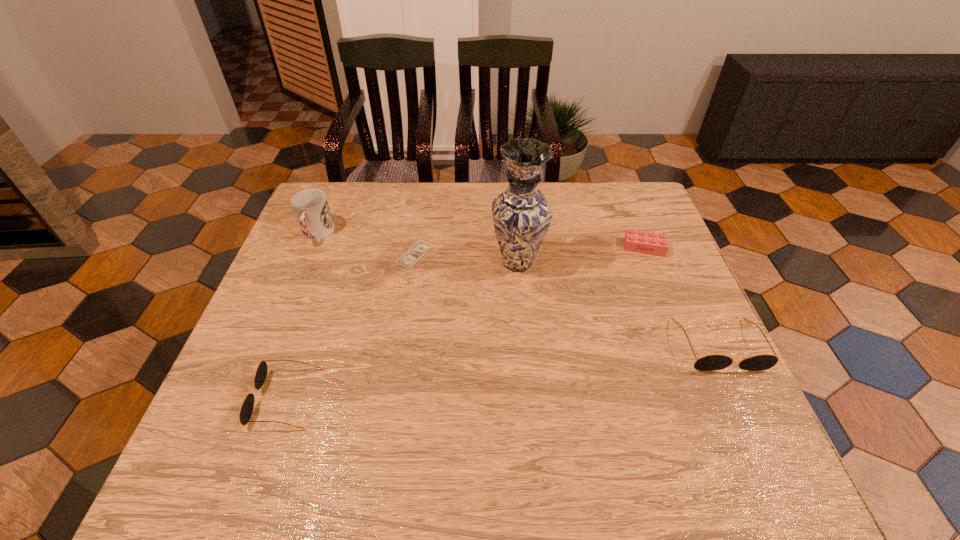
Locate an element on the screen. The image size is (960, 540). blank area located on the front-facing side of the shorter sunglasses is located at coordinates (222, 398).

Identify the location of vacant space positioned 0.120m on the front-facing side of the right sunglasses. The height and width of the screenshot is (540, 960). (756, 427).

This screenshot has height=540, width=960. In order to click on free spot located 0.280m on the front of the shortest object in this screenshot , I will do `click(399, 356)`.

The image size is (960, 540). Identify the location of free space located on the front of the Lego. (678, 332).

Identify the location of vacant space located 0.090m on the side of the fifth shortest object where the handle is located. (300, 272).

Locate an element on the screen. The width and height of the screenshot is (960, 540). free location located 0.150m on the left of the vase is located at coordinates (435, 262).

What are the coordinates of `object located at the far edge` in the screenshot? It's located at (311, 209).

Find the location of a particular element. The image size is (960, 540). object located in the near edge section of the desktop is located at coordinates [x=246, y=410].

Identify the location of sunglasses present at the left edge. The width and height of the screenshot is (960, 540). (246, 410).

I want to click on cup positioned at the left edge, so click(x=311, y=209).